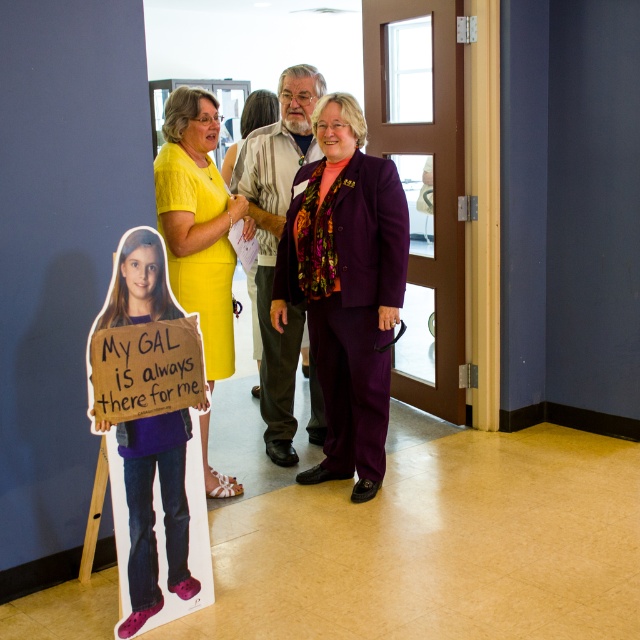
You are a photographer setting up for a group photo. You need to position yourself so that both the purple fabric suit at center and the yellow fabric dress at center are in focus. Which one should you focus on first to ensure both are clear?

You should focus on the purple fabric suit at center first because it is closer to the viewer, ensuring that both it and the yellow fabric dress at center will be in focus when using proper depth of field.

You are a photographer in the hallway and want to ensure both the purple satin suit at center and the multicolored patterned suit at center are fully visible in your photo. Which suit should you focus on to frame the shot properly?

The purple satin suit at center is smaller than the multicolored patterned suit at center, so you should focus on the larger multicolored patterned suit at center to ensure both are fully visible in the photo.